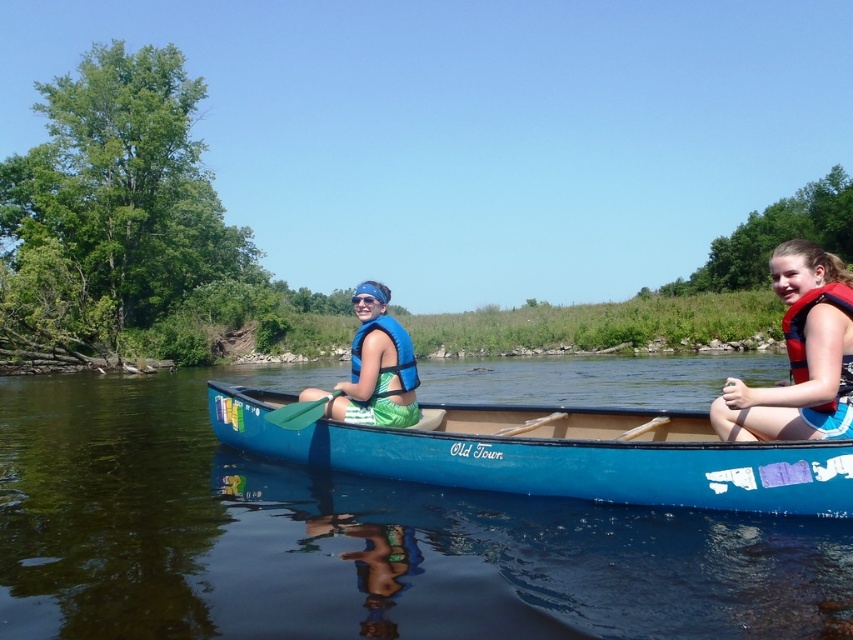
Does blue wood canoe at center lie in front of blue fabric life vest at center?

That is True.

Is blue wood canoe at center to the right of blue fabric life vest at center from the viewer's perspective?

Correct, you'll find blue wood canoe at center to the right of blue fabric life vest at center.

Which is in front, point (653, 496) or point (328, 408)?

Point (653, 496) is in front.

At what (x,y) coordinates should I click in order to perform the action: click on blue wood canoe at center. Please return your answer as a coordinate pair (x, y). Looking at the image, I should click on (556, 454).

Between point (689, 451) and point (728, 381), which one is positioned behind?

The point (689, 451) is more distant.

Between blue wood canoe at center and red life vest at right, which one appears on the left side from the viewer's perspective?

From the viewer's perspective, blue wood canoe at center appears more on the left side.

This screenshot has width=853, height=640. I want to click on blue wood canoe at center, so click(x=556, y=454).

Does blue plastic canoe at center have a lesser width compared to red life vest at right?

Incorrect, blue plastic canoe at center's width is not less than red life vest at right's.

Between blue plastic canoe at center and red life vest at right, which one appears on the right side from the viewer's perspective?

red life vest at right

Between point (520, 372) and point (746, 394), which one is positioned behind?

Positioned behind is point (520, 372).

Locate an element on the screen. This screenshot has width=853, height=640. blue plastic canoe at center is located at coordinates (354, 540).